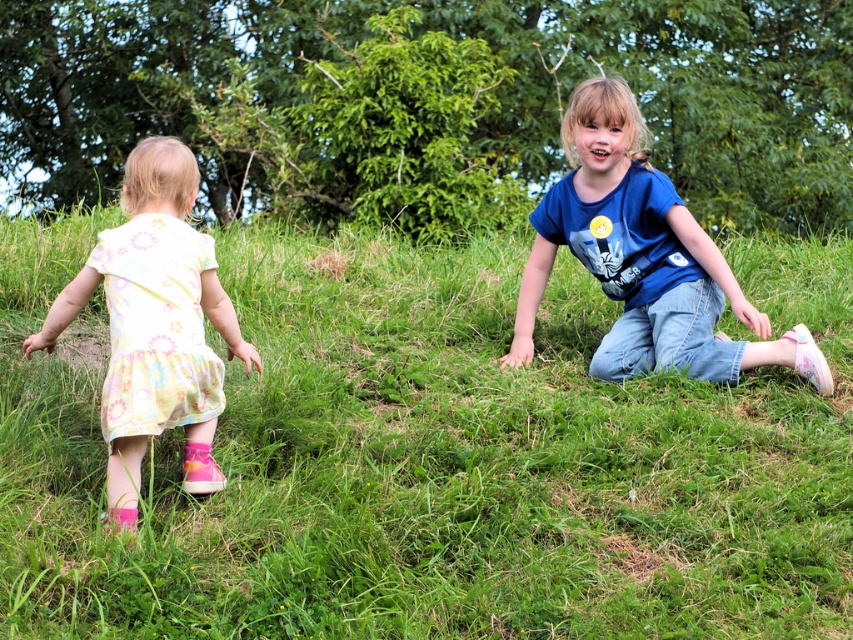
Can you confirm if green grass at center is taller than blue cotton shirt at center?

No.

Looking at this image, between green grass at center and blue cotton shirt at center, which one appears on the right side from the viewer's perspective?

blue cotton shirt at center is more to the right.

What do you see at coordinates (431, 458) in the screenshot? I see `green grass at center` at bounding box center [431, 458].

This screenshot has height=640, width=853. Identify the location of green grass at center. (431, 458).

Image resolution: width=853 pixels, height=640 pixels. Describe the element at coordinates (431, 458) in the screenshot. I see `green grass at center` at that location.

The height and width of the screenshot is (640, 853). What do you see at coordinates (431, 458) in the screenshot? I see `green grass at center` at bounding box center [431, 458].

Locate an element on the screen. Image resolution: width=853 pixels, height=640 pixels. green grass at center is located at coordinates (431, 458).

Who is more forward, (651, 212) or (161, 196)?

Point (161, 196)

What do you see at coordinates (643, 259) in the screenshot?
I see `blue cotton shirt at center` at bounding box center [643, 259].

Locate an element on the screen. The height and width of the screenshot is (640, 853). blue cotton shirt at center is located at coordinates (643, 259).